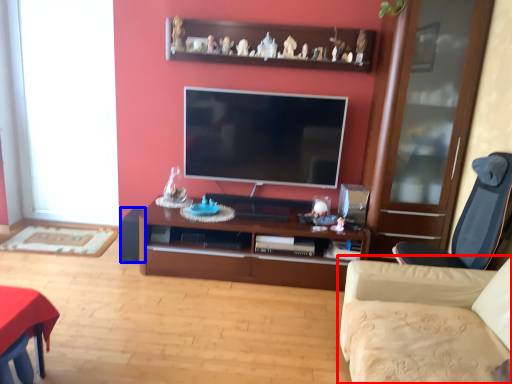
Question: Which object is further to the camera taking this photo, studio couch (highlighted by a red box) or speaker (highlighted by a blue box)?

Choices:
 (A) studio couch
 (B) speaker

Answer: (B)